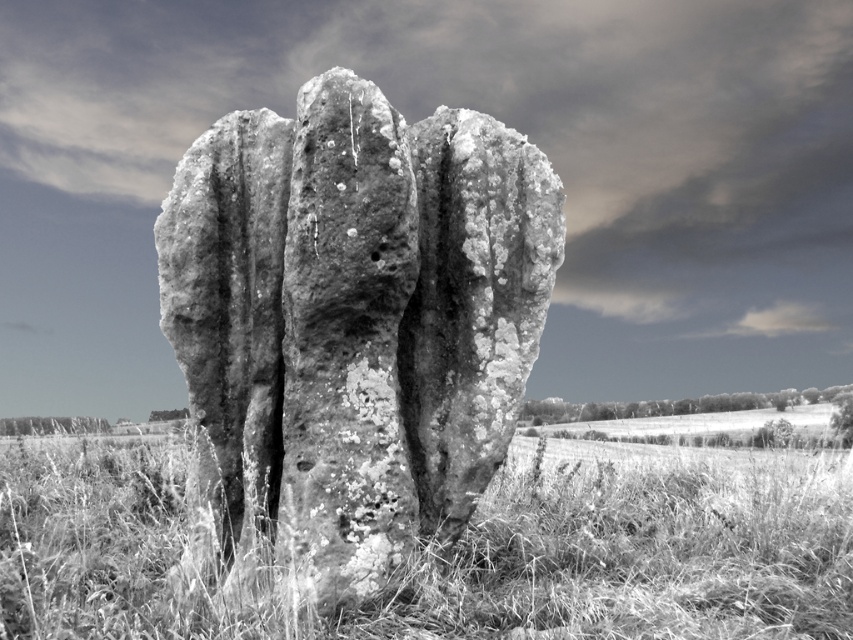
You are a landscape architect planning to install a small garden between the rough stone rock at center and the fuzzy grass at center. The garden requires a minimum of 5 meters of space between them. Based on the scene, will there be enough space?

The rough stone rock at center is 4.39 meters from fuzzy grass at center, which is less than the required 5 meters. Therefore, there isn not enough space for the garden.

You are standing in front of the large stone structure that looks like a cactus. If you want to place a small decorative rock exactly where the fuzzy grass at center is located, what are the coordinates you should aim for?

You should aim for the coordinates point at (643, 554) where the fuzzy grass at center is located.